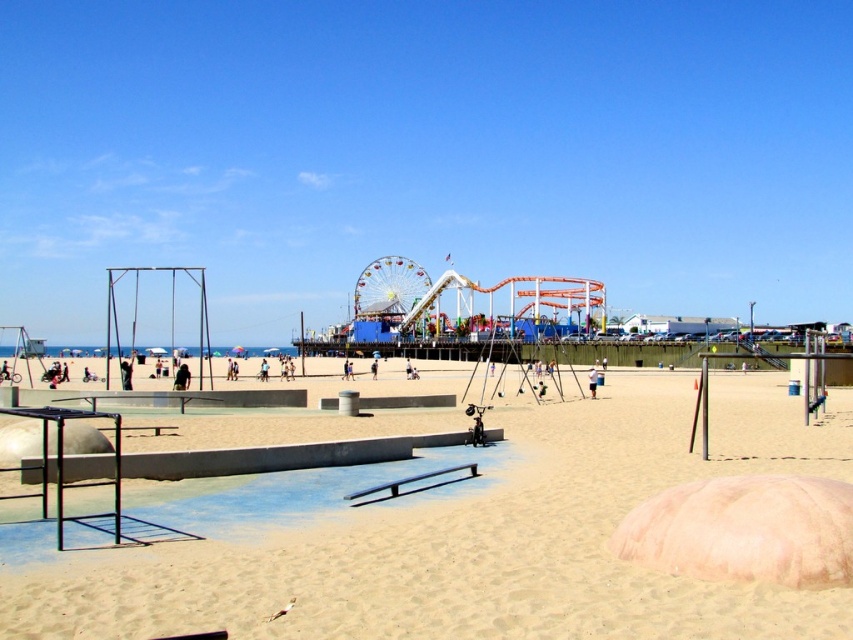
Question: Is light brown sand at center positioned in front of multicolored metallic ferris wheel at center?

Choices:
 (A) no
 (B) yes

Answer: (B)

Question: Which of the following is the farthest from the observer?

Choices:
 (A) light brown sand at center
 (B) multicolored metallic ferris wheel at center

Answer: (B)

Question: Among these objects, which one is nearest to the camera?

Choices:
 (A) light brown sand at center
 (B) multicolored metallic ferris wheel at center

Answer: (A)

Question: Can you confirm if light brown sand at center is positioned below multicolored metallic ferris wheel at center?

Choices:
 (A) no
 (B) yes

Answer: (B)

Question: Can you confirm if light brown sand at center is wider than multicolored metallic ferris wheel at center?

Choices:
 (A) yes
 (B) no

Answer: (A)